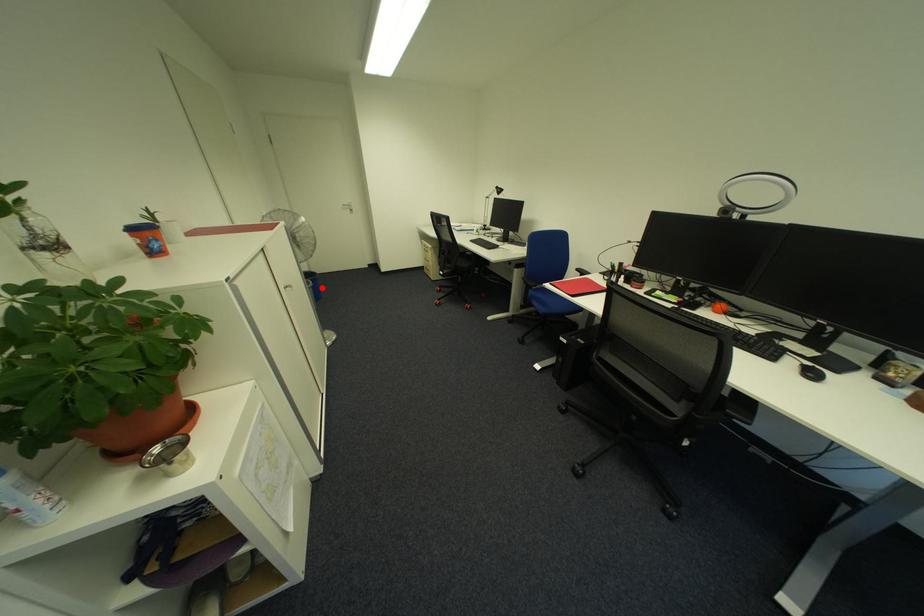
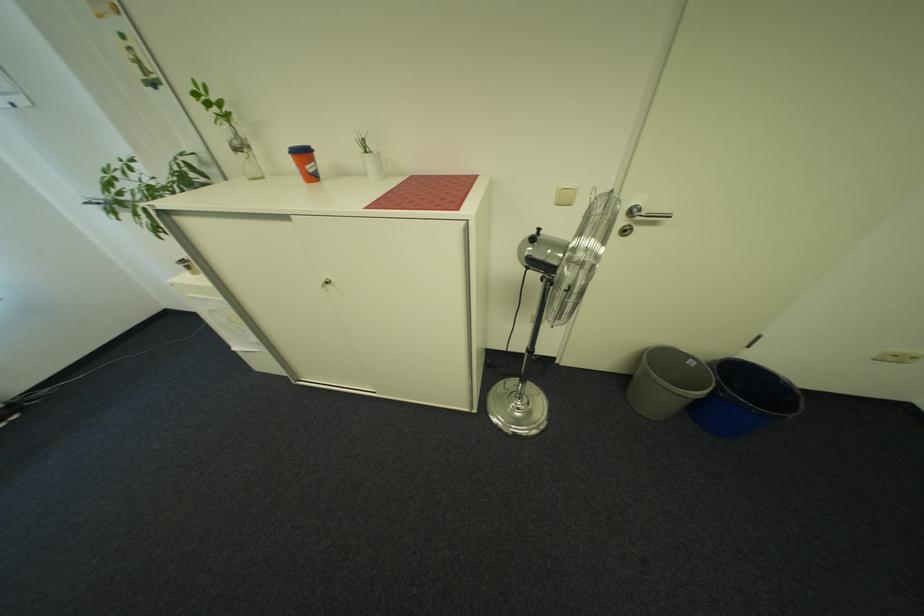
Find the pixel in the second image that matches the highlighted location in the first image.

(707, 403)